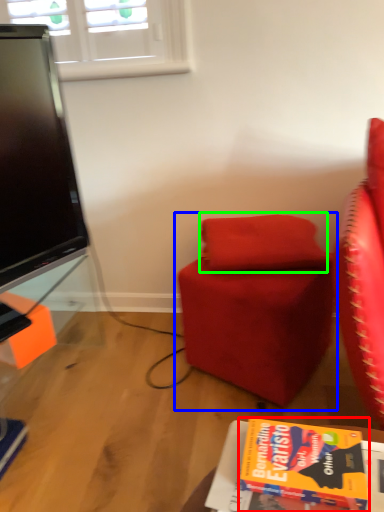
Question: Which object is positioned farthest from book (highlighted by a red box)? Select from chair (highlighted by a blue box) and pillow (highlighted by a green box).

Choices:
 (A) chair
 (B) pillow

Answer: (B)